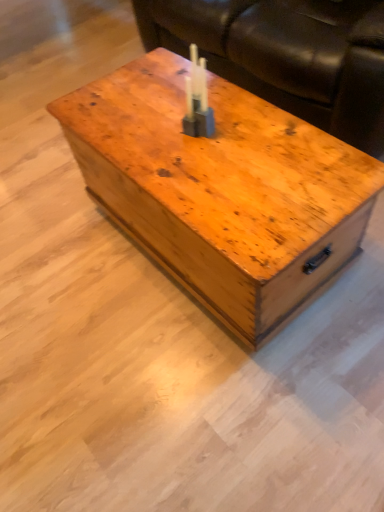
What is the approximate height of wooden chest at center?

wooden chest at center is 19.62 inches in height.

I want to click on wooden chest at center, so click(x=222, y=191).

Is wooden chest at center touching brown leather couch at upper center?

wooden chest at center and brown leather couch at upper center are not in contact.

Is wooden chest at center taller or shorter than brown leather couch at upper center?

wooden chest at center is shorter than brown leather couch at upper center.

How many degrees apart are the facing directions of wooden chest at center and brown leather couch at upper center?

The angular difference between wooden chest at center and brown leather couch at upper center is 0.994 degrees.

Is brown leather couch at upper center located within wooden chest at center?

Actually, brown leather couch at upper center is outside wooden chest at center.

Based on the photo, does brown leather couch at upper center come in front of translucent plastic candle at center?

No, brown leather couch at upper center is further to the viewer.

Based on the photo, can you confirm if brown leather couch at upper center is bigger than translucent plastic candle at center?

Yes.

Would you say brown leather couch at upper center contains translucent plastic candle at center?

Actually, translucent plastic candle at center is outside brown leather couch at upper center.

From the image's perspective, is brown leather couch at upper center above or below translucent plastic candle at center?

brown leather couch at upper center is situated higher than translucent plastic candle at center in the image.

How many degrees apart are the facing directions of translucent plastic candle at center and wooden chest at center?

The angle between the facing direction of translucent plastic candle at center and the facing direction of wooden chest at center is 2.98 degrees.

Does translucent plastic candle at center have a lesser height compared to wooden chest at center?

Yes, translucent plastic candle at center is shorter than wooden chest at center.

Is point (203, 93) closer or farther from the camera than point (270, 223)?

Point (203, 93) is positioned farther from the camera compared to point (270, 223).

Is translucent plastic candle at center positioned far away from brown leather couch at upper center?

No, there isn't a large distance between translucent plastic candle at center and brown leather couch at upper center.

From the image's perspective, is translucent plastic candle at center above or below brown leather couch at upper center?

From the image's perspective, translucent plastic candle at center appears below brown leather couch at upper center.

Based on the photo, which of these two, translucent plastic candle at center or brown leather couch at upper center, stands taller?

With more height is brown leather couch at upper center.

Which is farther from the camera, (317, 50) or (302, 270)?

The point (317, 50) is farther from the camera.

Is the position of brown leather couch at upper center less distant than that of wooden chest at center?

No.

From the image's perspective, is brown leather couch at upper center located above or below wooden chest at center?

brown leather couch at upper center is above wooden chest at center.

Considering the relative sizes of wooden chest at center and translucent plastic candle at center in the image provided, is wooden chest at center thinner than translucent plastic candle at center?

In fact, wooden chest at center might be wider than translucent plastic candle at center.

Is wooden chest at center situated inside translucent plastic candle at center or outside?

wooden chest at center is spatially situated outside translucent plastic candle at center.

Considering the positions of objects wooden chest at center and translucent plastic candle at center in the image provided, who is behind, wooden chest at center or translucent plastic candle at center?

translucent plastic candle at center is further away from the camera.

At what (x,y) coordinates should I click in order to perform the action: click on couch above the wooden chest at center (from a real-world perspective). Please return your answer as a coordinate pair (x, y). Looking at the image, I should click on (287, 55).

Image resolution: width=384 pixels, height=512 pixels. In order to click on birthday candle in front of the brown leather couch at upper center in this screenshot , I will do `click(197, 99)`.

Looking at the image, which one is located closer to brown leather couch at upper center, translucent plastic candle at center or wooden chest at center?

wooden chest at center is closer to brown leather couch at upper center.

Estimate the real-world distances between objects in this image. Which object is closer to translucent plastic candle at center, wooden chest at center or brown leather couch at upper center?

Among the two, wooden chest at center is located nearer to translucent plastic candle at center.

Looking at the image, which one is located closer to brown leather couch at upper center, wooden chest at center or translucent plastic candle at center?

wooden chest at center is closer to brown leather couch at upper center.

Looking at the image, which one is located further to wooden chest at center, brown leather couch at upper center or translucent plastic candle at center?

brown leather couch at upper center lies further to wooden chest at center than the other object.

Based on their spatial positions, is translucent plastic candle at center or brown leather couch at upper center closer to wooden chest at center?

Based on the image, translucent plastic candle at center appears to be nearer to wooden chest at center.

Which object lies nearer to the anchor point translucent plastic candle at center, brown leather couch at upper center or wooden chest at center?

Among the two, wooden chest at center is located nearer to translucent plastic candle at center.

You are a GUI agent. You are given a task and a screenshot of the screen. Output one action in this format:
    pyautogui.click(x=<x>, y=<y>)
    Task: Click on the birthday candle between brown leather couch at upper center and wooden chest at center from top to bottom
    
    Given the screenshot: What is the action you would take?
    (x=197, y=99)